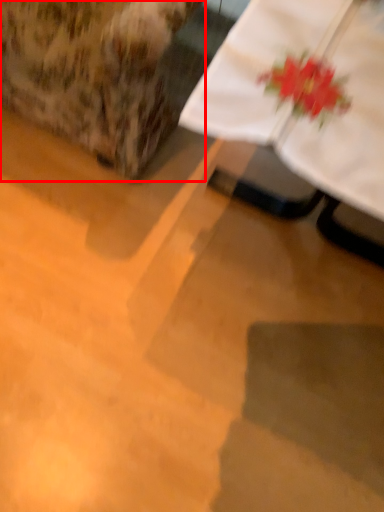
Question: From the image's perspective, where is armchair (annotated by the red box) located relative to table?

Choices:
 (A) below
 (B) above

Answer: (B)